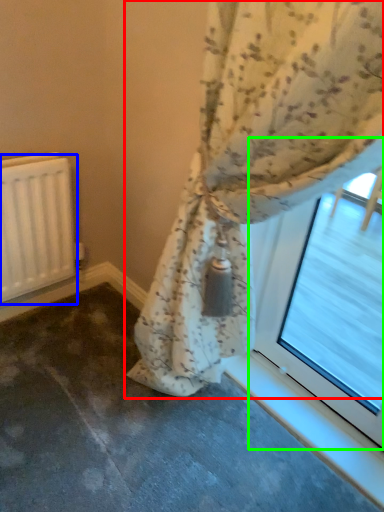
Question: Based on their relative distances, which object is farther from curtain (highlighted by a red box)? Choose from radiator (highlighted by a blue box) and bay window (highlighted by a green box).

Choices:
 (A) radiator
 (B) bay window

Answer: (A)